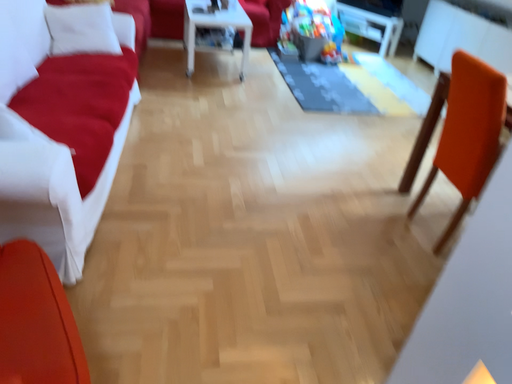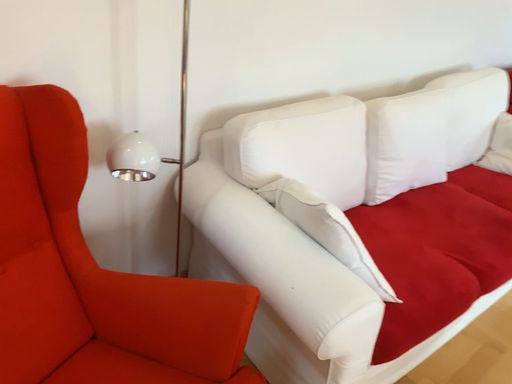
Question: How did the camera likely rotate when shooting the video?

Choices:
 (A) rotated left
 (B) rotated right

Answer: (A)